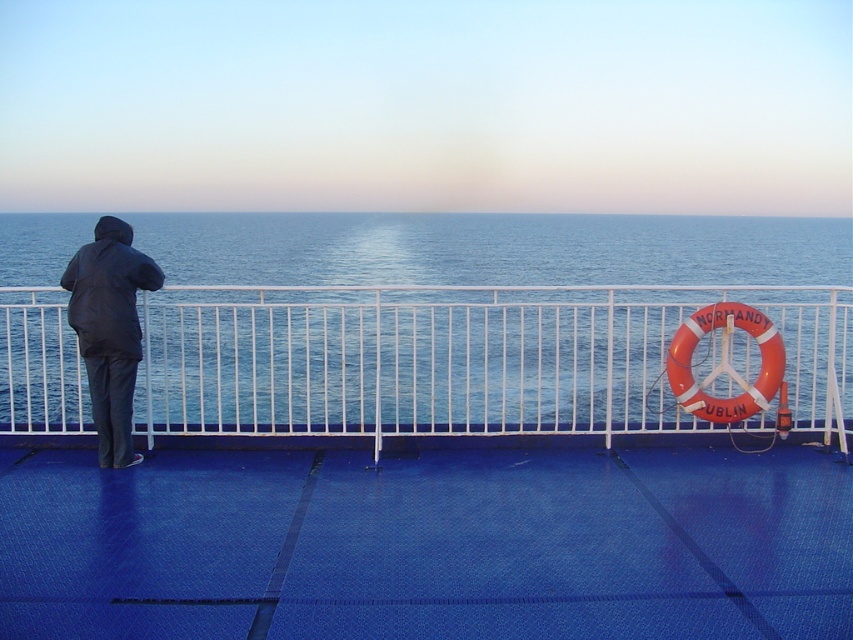
Question: Which point is closer to the camera?

Choices:
 (A) (418, 561)
 (B) (198, 353)
 (C) (96, 365)

Answer: (A)

Question: Observing the image, what is the correct spatial positioning of white metal fence at left in reference to dark blue fabric jacket at left?

Choices:
 (A) right
 (B) left

Answer: (A)

Question: Which of the following is the farthest from the observer?

Choices:
 (A) (131, 227)
 (B) (596, 285)

Answer: (B)

Question: Is the position of blue textured deck at center less distant than that of white metal fence at left?

Choices:
 (A) yes
 (B) no

Answer: (A)

Question: Which is nearer to the dark blue fabric jacket at left?

Choices:
 (A) blue textured deck at center
 (B) white metal fence at left

Answer: (B)

Question: Does white metal fence at left have a smaller size compared to dark blue fabric jacket at left?

Choices:
 (A) no
 (B) yes

Answer: (A)